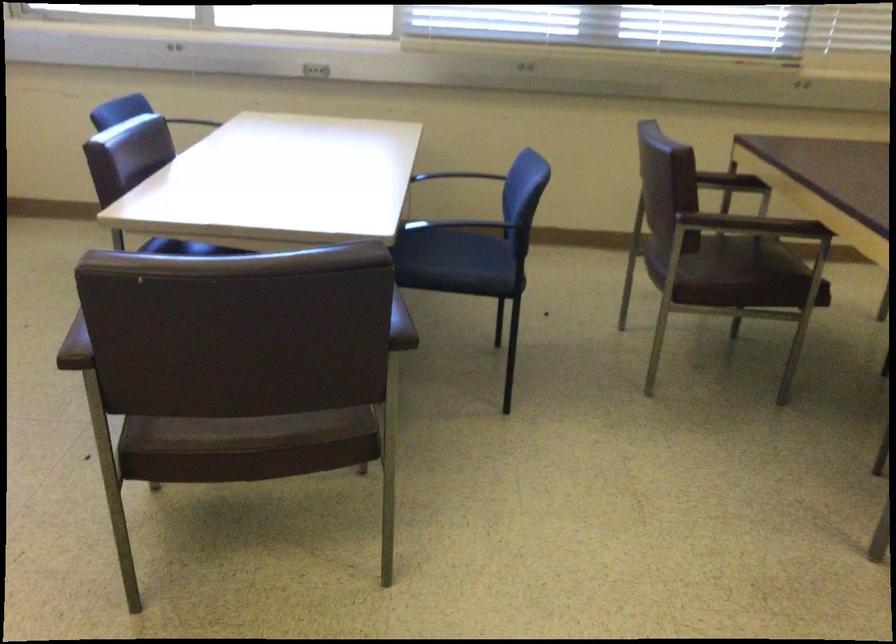
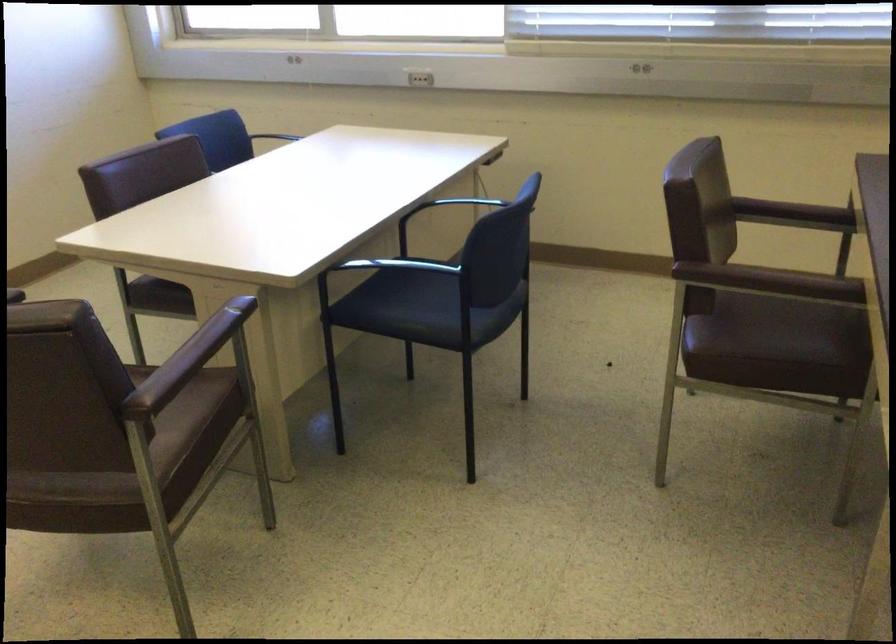
The images are taken continuously from a first-person perspective. In which direction are you moving?

The cameraman walked toward right, forward.